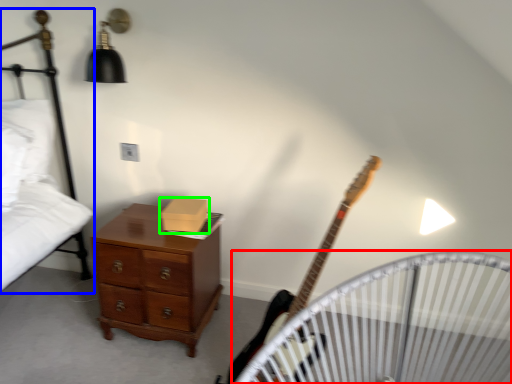
Question: Which is nearer to the infant bed (highlighted by a red box)? bed (highlighted by a blue box) or box (highlighted by a green box).

Choices:
 (A) bed
 (B) box

Answer: (B)